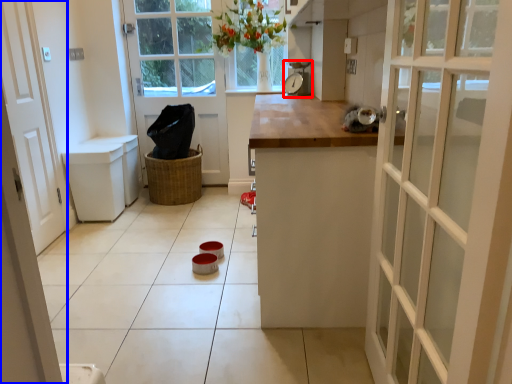
Question: Among these objects, which one is nearest to the camera, appliance (highlighted by a red box) or door (highlighted by a blue box)?

Choices:
 (A) appliance
 (B) door

Answer: (B)